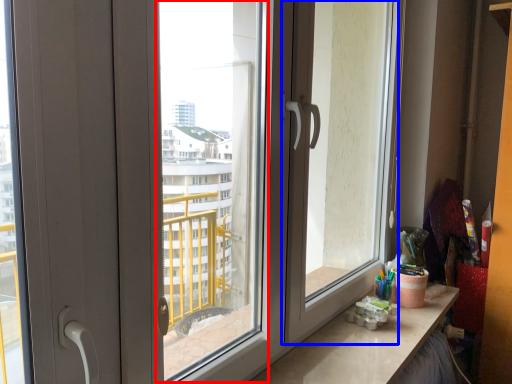
Question: Among these objects, which one is farthest to the camera, window screen (highlighted by a red box) or screen door (highlighted by a blue box)?

Choices:
 (A) window screen
 (B) screen door

Answer: (B)